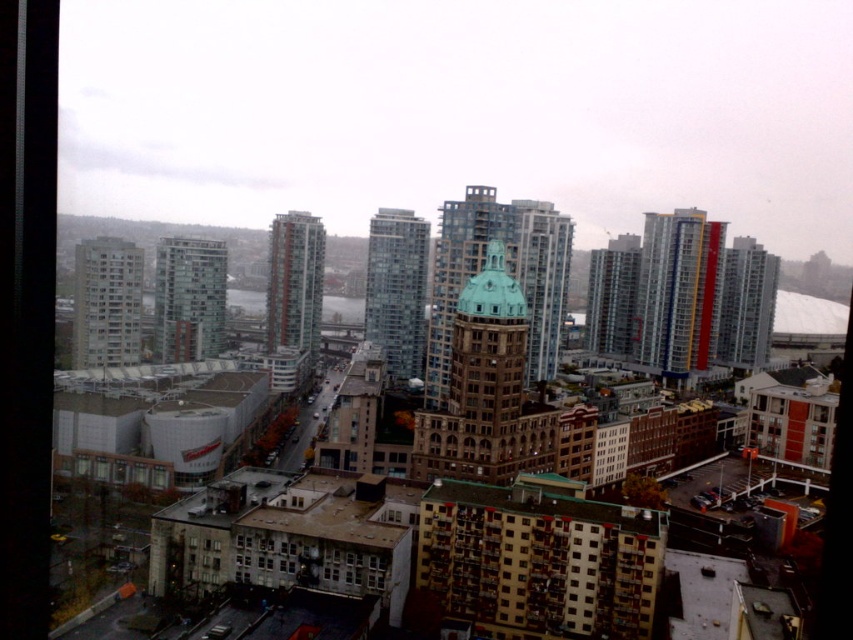
Between glassy reflective skyscraper at center and metallic glass building at right, which one appears on the right side from the viewer's perspective?

metallic glass building at right

Does point (405, 310) come farther from viewer compared to point (733, 316)?

No.

I want to click on glassy reflective skyscraper at center, so click(x=396, y=289).

Is brown textured apartment building at lower center closer to camera compared to green copper dome at center?

Yes.

Between brown textured apartment building at lower center and green copper dome at center, which one appears on the right side from the viewer's perspective?

green copper dome at center

You are a GUI agent. You are given a task and a screenshot of the screen. Output one action in this format:
    pyautogui.click(x=<x>, y=<y>)
    Task: Click on the brown textured apartment building at lower center
    The image size is (853, 640).
    Given the screenshot: What is the action you would take?
    pyautogui.click(x=541, y=561)

Can you confirm if brown textured apartment building at lower center is thinner than metallic glass building at right?

Incorrect, brown textured apartment building at lower center's width is not less than metallic glass building at right's.

Which is in front, point (561, 500) or point (730, 316)?

Point (561, 500)

Identify the location of brown textured apartment building at lower center. (541, 561).